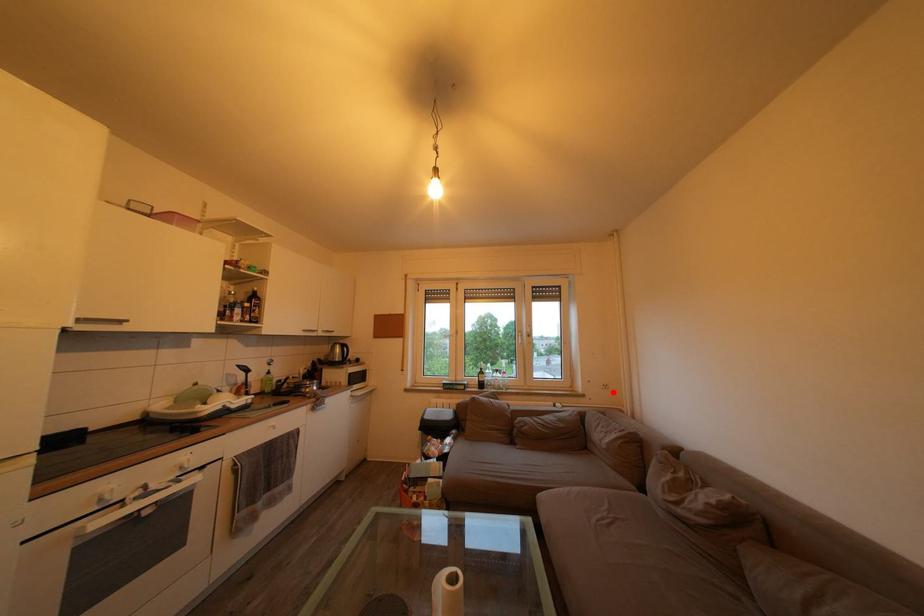
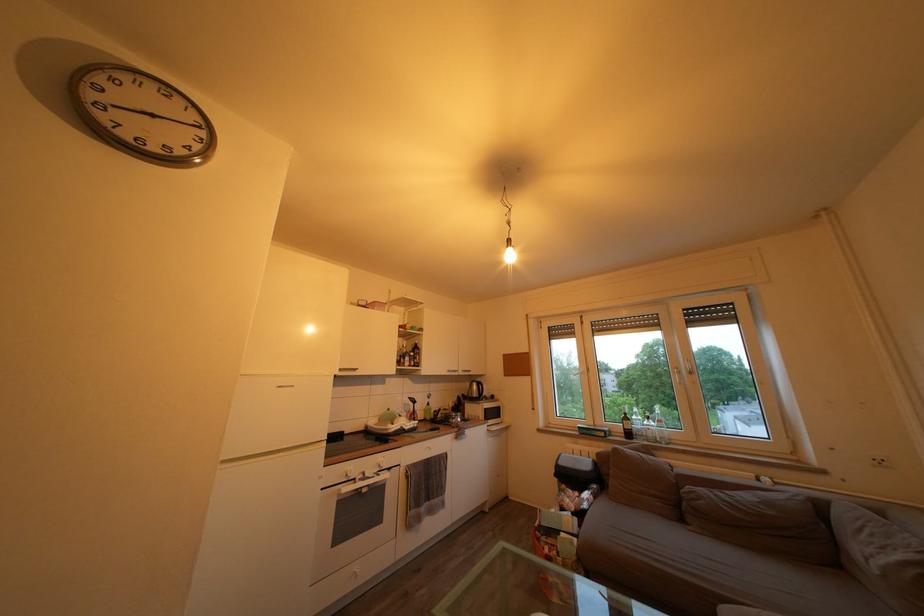
In the second image, find the point that corresponds to the highlighted location in the first image.

(889, 468)